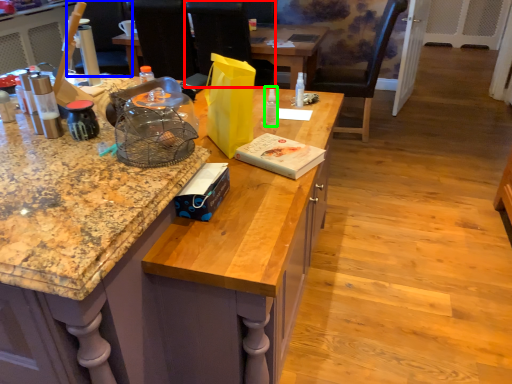
Question: Estimate the real-world distances between objects in this image. Which object is closer to armchair (highlighted by a red box), armchair (highlighted by a blue box) or bottle (highlighted by a green box)?

Choices:
 (A) armchair
 (B) bottle

Answer: (A)